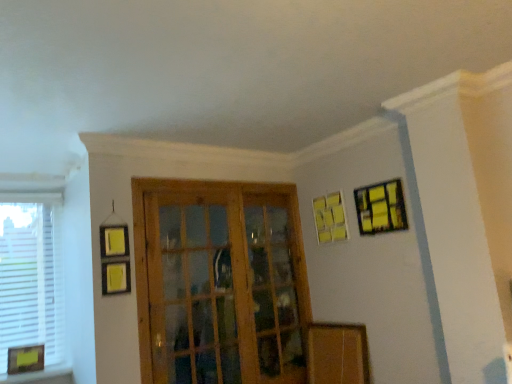
Question: Looking at the image, does yellow matte picture frame at upper right, which ranks as the 2th picture frame in left-to-right order, seem bigger or smaller compared to white matte window at left?

Choices:
 (A) small
 (B) big

Answer: (A)

Question: Is yellow matte picture frame at upper right, acting as the 2th picture frame starting from the top, inside or outside of white matte window at left?

Choices:
 (A) outside
 (B) inside

Answer: (A)

Question: Which of these objects is positioned closest to the yellow matte picture frame at upper right, the second picture frame when ordered from bottom to top?

Choices:
 (A) white matte window at left
 (B) yellow matte picture frame at upper right, which is the third picture frame from left to right
 (C) yellow matte picture frame at lower left, the third picture frame from the right
 (D) wooden screen door at center

Answer: (B)

Question: Estimate the real-world distances between objects in this image. Which object is closer to the white matte window at left?

Choices:
 (A) wooden screen door at center
 (B) yellow matte picture frame at lower left, the third picture frame from the right
 (C) yellow matte picture frame at upper right, which is the third picture frame from left to right
 (D) yellow matte picture frame at upper right, arranged as the second picture frame when viewed from the right

Answer: (B)